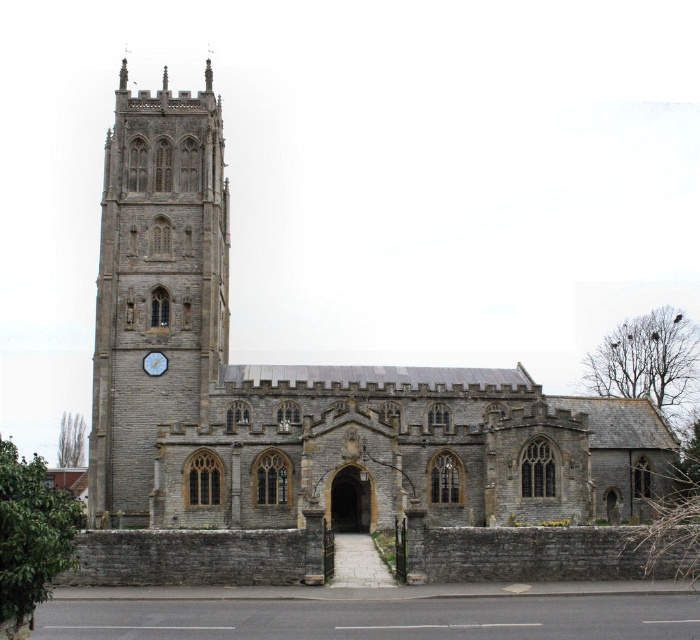
Question: Which point is closer to the camera?

Choices:
 (A) blue painted wood clock at left
 (B) gray stone church at center

Answer: (B)

Question: Considering the relative positions of gray stone church at center and gray stone tower at left in the image provided, where is gray stone church at center located with respect to gray stone tower at left?

Choices:
 (A) below
 (B) above

Answer: (A)

Question: Which object is the closest to the gray stone church at center?

Choices:
 (A) blue painted wood clock at left
 (B) gray stone tower at left

Answer: (B)

Question: Does gray stone church at center have a larger size compared to gray stone tower at left?

Choices:
 (A) yes
 (B) no

Answer: (A)

Question: Where is gray stone church at center located in relation to blue painted wood clock at left in the image?

Choices:
 (A) right
 (B) left

Answer: (A)

Question: Which object is positioned closest to the gray stone tower at left?

Choices:
 (A) blue painted wood clock at left
 (B) gray stone church at center

Answer: (B)